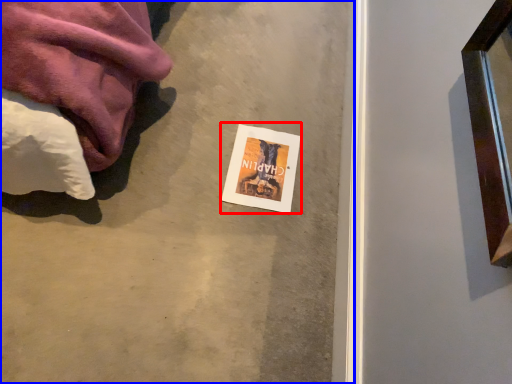
Question: Which of the following is the closest to the observer, flyer (highlighted by a red box) or concrete (highlighted by a blue box)?

Choices:
 (A) flyer
 (B) concrete

Answer: (B)